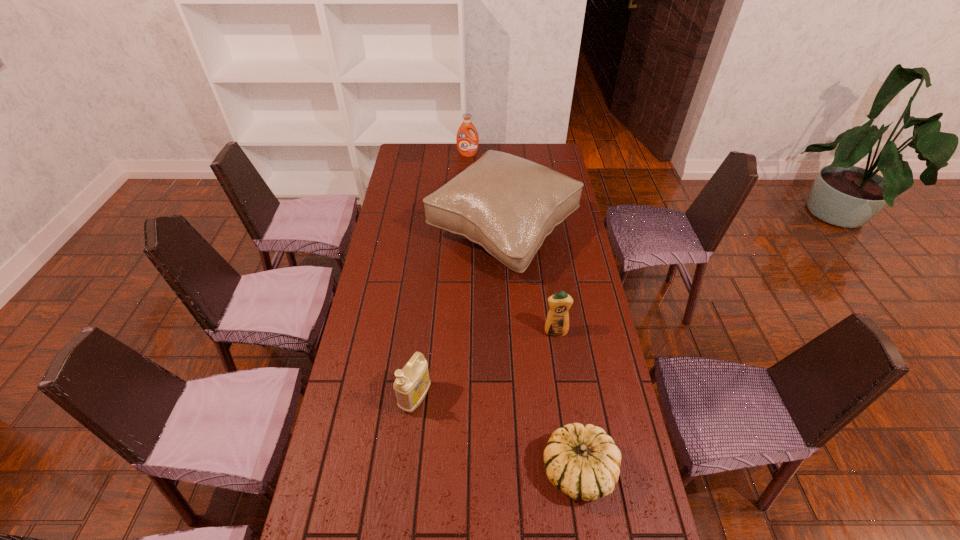
Select which object appears as the third closest to the third farthest object. Please provide its 2D coordinates. Your answer should be formatted as a tuple, i.e. [(x, y)], where the tuple contains the x and y coordinates of a point satisfying the conditions above.

[(411, 385)]

The height and width of the screenshot is (540, 960). I want to click on the second closest detergent to the shortest object, so click(557, 323).

The height and width of the screenshot is (540, 960). I want to click on detergent that stands as the closest to the second farthest detergent, so click(411, 385).

At what (x,y) coordinates should I click in order to perform the action: click on blank space that satisfies the following two spatial constraints: 1. on the back side of the cushion; 2. on the left side of the nearest detergent. Please return your answer as a coordinate pair (x, y). Looking at the image, I should click on (434, 233).